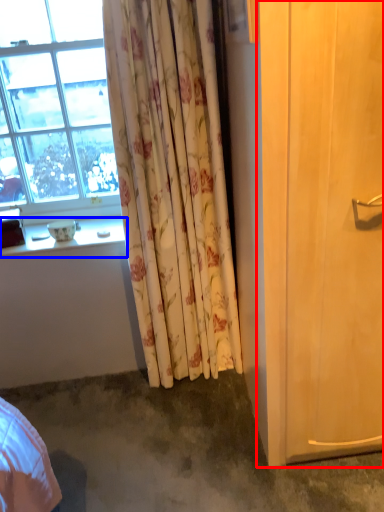
Question: Which of the following is the closest to the observer, screen door (highlighted by a red box) or window sill (highlighted by a blue box)?

Choices:
 (A) screen door
 (B) window sill

Answer: (A)